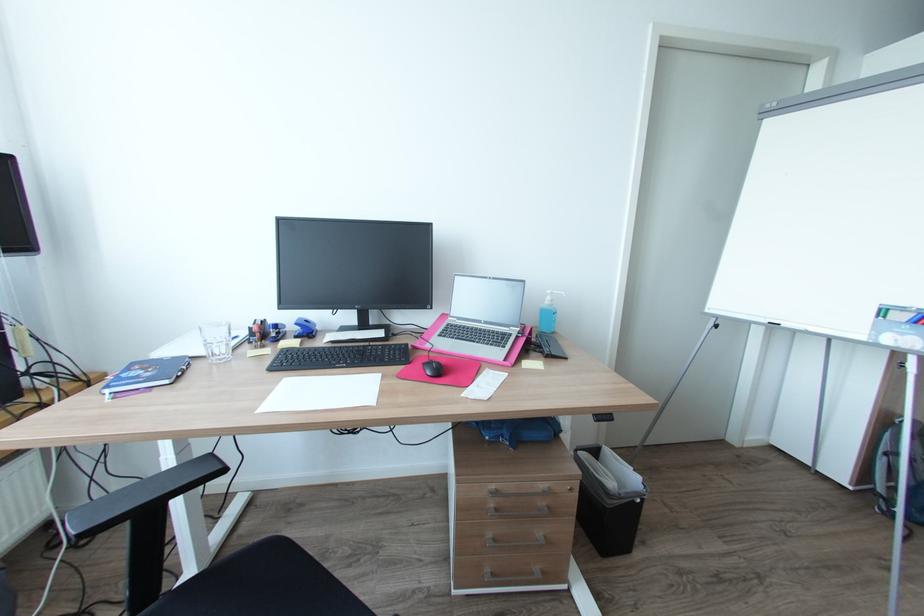
The location [216,341] corresponds to which object?

It corresponds to the glass drinking cup in the image.